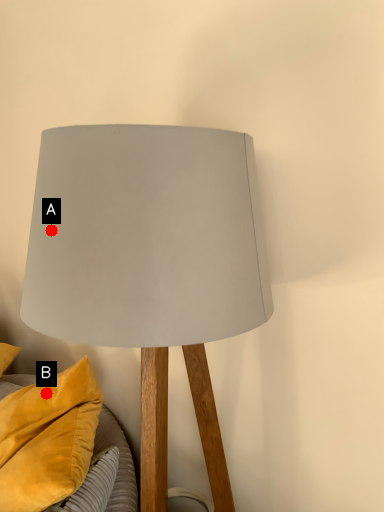
Question: Two points are circled on the image, labeled by A and B beside each circle. Which point is closer to the camera taking this photo?

Choices:
 (A) A is closer
 (B) B is closer

Answer: (A)